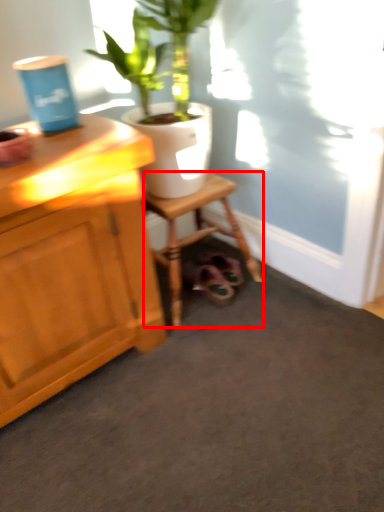
Question: From the image, what is the correct spatial relationship of stool (annotated by the red box) in relation to houseplant?

Choices:
 (A) right
 (B) left

Answer: (B)